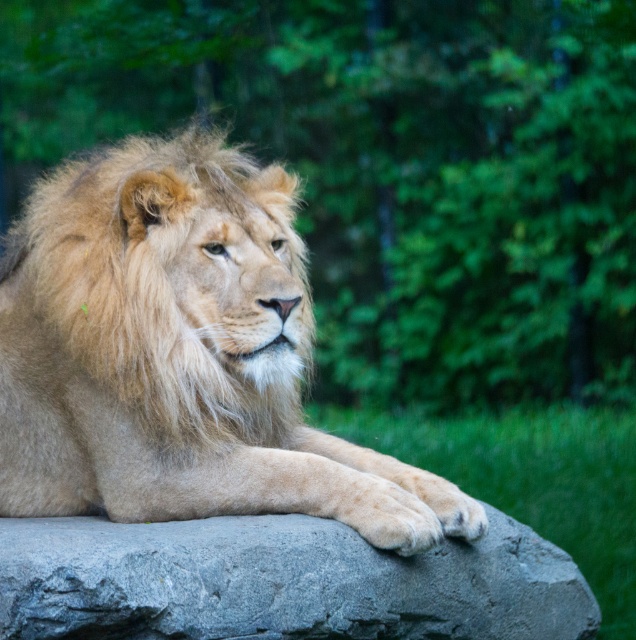
Question: Which of the following is the farthest from the observer?

Choices:
 (A) fuzzy golden mane at center
 (B) green leafy tree at upper center
 (C) gray rough stone at center

Answer: (B)

Question: Is green leafy tree at upper center bigger than fuzzy golden mane at center?

Choices:
 (A) yes
 (B) no

Answer: (A)

Question: Is the position of green leafy tree at upper center more distant than that of gray rough stone at center?

Choices:
 (A) no
 (B) yes

Answer: (B)

Question: Observing the image, what is the correct spatial positioning of green leafy tree at upper center in reference to fuzzy golden mane at center?

Choices:
 (A) right
 (B) left

Answer: (A)

Question: Based on their relative distances, which object is farther from the fuzzy golden mane at center?

Choices:
 (A) golden fur lion at center
 (B) gray rough stone at center

Answer: (B)

Question: Estimate the real-world distances between objects in this image. Which object is closer to the green leafy tree at upper center?

Choices:
 (A) golden fur lion at center
 (B) fuzzy golden mane at center
 (C) gray rough stone at center

Answer: (A)